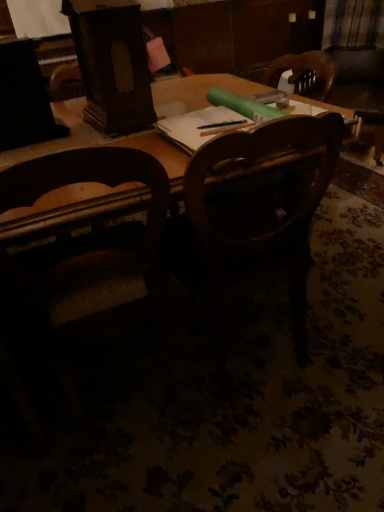
Question: Can you confirm if wooden chair at center, the second chair from the left, is shorter than plaid fabric at upper right?

Choices:
 (A) no
 (B) yes

Answer: (A)

Question: Does wooden chair at center, positioned as the first chair in right-to-left order, touch plaid fabric at upper right?

Choices:
 (A) yes
 (B) no

Answer: (B)

Question: Are wooden chair at center, positioned as the first chair in right-to-left order, and plaid fabric at upper right located far from each other?

Choices:
 (A) yes
 (B) no

Answer: (A)

Question: From a real-world perspective, does wooden chair at center, the second chair from the left, sit lower than plaid fabric at upper right?

Choices:
 (A) no
 (B) yes

Answer: (B)

Question: From the image's perspective, is wooden chair at center, the second chair from the left, on plaid fabric at upper right?

Choices:
 (A) yes
 (B) no

Answer: (B)

Question: Is wooden chair at center, the second chair from the left, completely or partially outside of plaid fabric at upper right?

Choices:
 (A) yes
 (B) no

Answer: (A)

Question: Does wooden chair at left, the first chair positioned from the left, come behind plaid fabric at upper right?

Choices:
 (A) no
 (B) yes

Answer: (A)

Question: Does wooden chair at left, placed as the second chair when sorted from right to left, touch plaid fabric at upper right?

Choices:
 (A) no
 (B) yes

Answer: (A)

Question: Is wooden chair at left, the first chair positioned from the left, located outside plaid fabric at upper right?

Choices:
 (A) yes
 (B) no

Answer: (A)

Question: Does wooden chair at left, the first chair positioned from the left, appear on the right side of plaid fabric at upper right?

Choices:
 (A) no
 (B) yes

Answer: (A)

Question: Is wooden chair at left, the first chair positioned from the left, facing towards plaid fabric at upper right?

Choices:
 (A) no
 (B) yes

Answer: (A)

Question: Can you confirm if wooden chair at left, the first chair positioned from the left, is taller than plaid fabric at upper right?

Choices:
 (A) no
 (B) yes

Answer: (B)

Question: Considering the relative sizes of wooden chair at center, the second chair from the left, and wooden chair at left, placed as the second chair when sorted from right to left, in the image provided, is wooden chair at center, the second chair from the left, wider than wooden chair at left, placed as the second chair when sorted from right to left,?

Choices:
 (A) yes
 (B) no

Answer: (A)